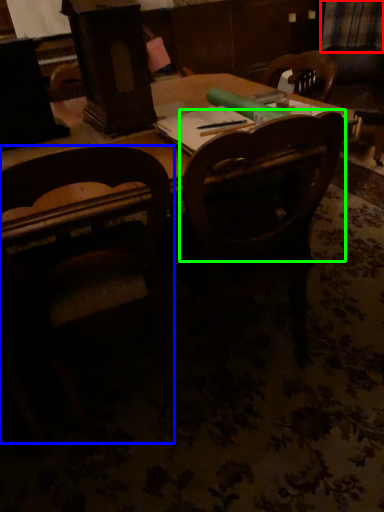
Question: Estimate the real-world distances between objects in this image. Which object is farther from plaid (highlighted by a red box), chair (highlighted by a blue box) or chair (highlighted by a green box)?

Choices:
 (A) chair
 (B) chair

Answer: (A)